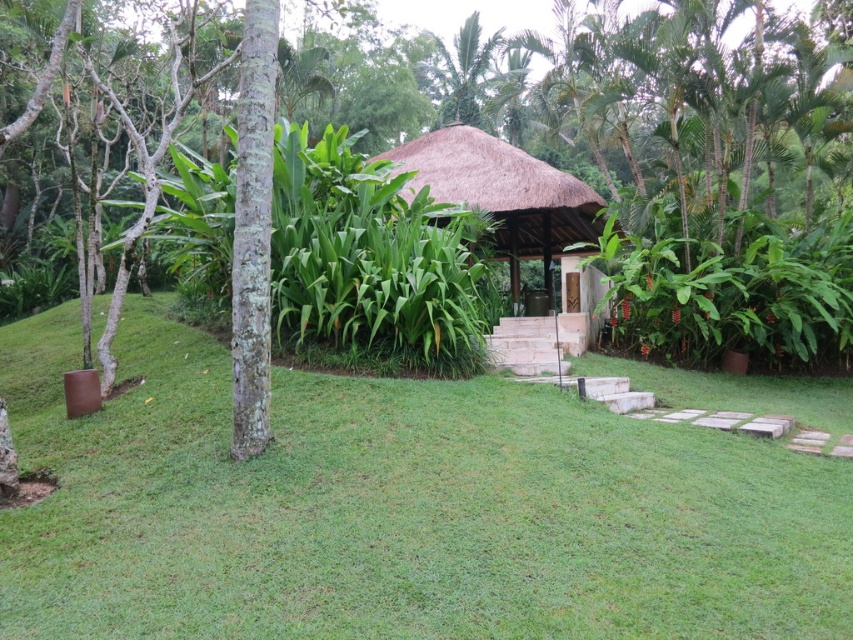
You are planning to set up a picnic in the tropical garden. You need to choose between placing your blanket under the brown textured tree at center or near the thatched straw gazebo at center. Which location offers more shade due to its size?

The brown textured tree at center is bigger than the thatched straw gazebo at center, so it provides more shade. Therefore, placing the blanket under the brown textured tree at center would offer more shade.